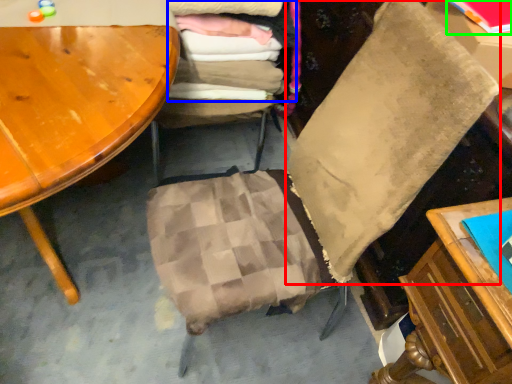
Question: Considering the real-world distances, which object is closest to pillow (highlighted by a red box)? laundry (highlighted by a blue box) or book (highlighted by a green box).

Choices:
 (A) laundry
 (B) book

Answer: (B)